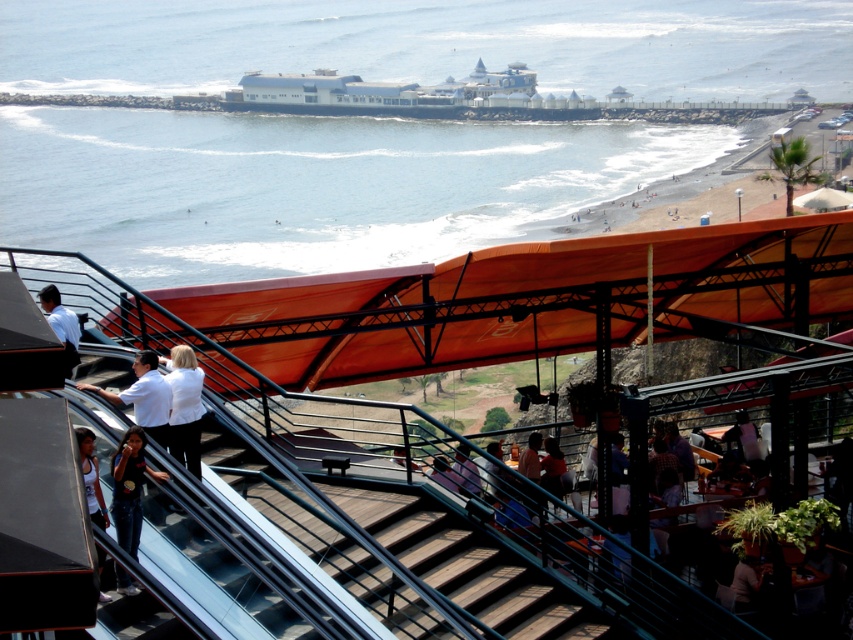
Is white jersey at lower left further to the viewer compared to matte white shirt at left?

Yes, white jersey at lower left is behind matte white shirt at left.

Is white jersey at lower left to the left of matte white shirt at left from the viewer's perspective?

Incorrect, white jersey at lower left is not on the left side of matte white shirt at left.

Locate an element on the screen. white jersey at lower left is located at coordinates (91, 477).

Which is below, white shirt at lower left or dark purple shirt at center?

Positioned lower is dark purple shirt at center.

Can you confirm if white shirt at lower left is thinner than dark purple shirt at center?

Incorrect, white shirt at lower left's width is not less than dark purple shirt at center's.

Is point (148, 406) positioned behind point (479, 484)?

That is False.

At what (x,y) coordinates should I click in order to perform the action: click on white shirt at lower left. Please return your answer as a coordinate pair (x, y). This screenshot has width=853, height=640. Looking at the image, I should click on (143, 396).

Which is above, matte white shirt at left or dark purple shirt at center?

matte white shirt at left is above.

How much distance is there between matte white shirt at left and dark purple shirt at center?

matte white shirt at left and dark purple shirt at center are 11.46 meters apart.

Between point (45, 305) and point (471, 465), which one is positioned behind?

Positioned behind is point (471, 465).

Identify the location of matte white shirt at left. [x=61, y=324].